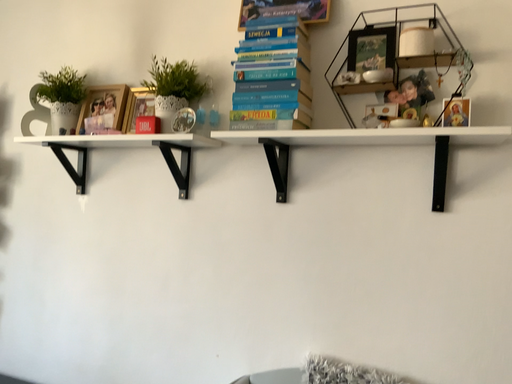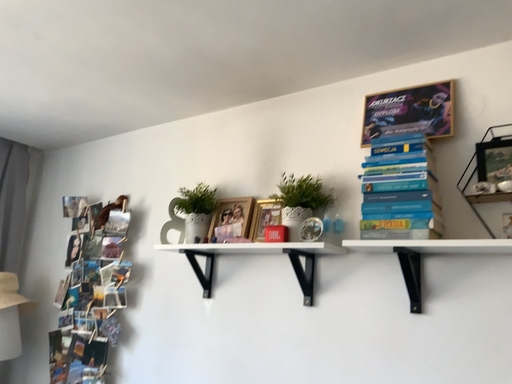
Question: How did the camera likely rotate when shooting the video?

Choices:
 (A) rotated downward
 (B) rotated upward

Answer: (B)